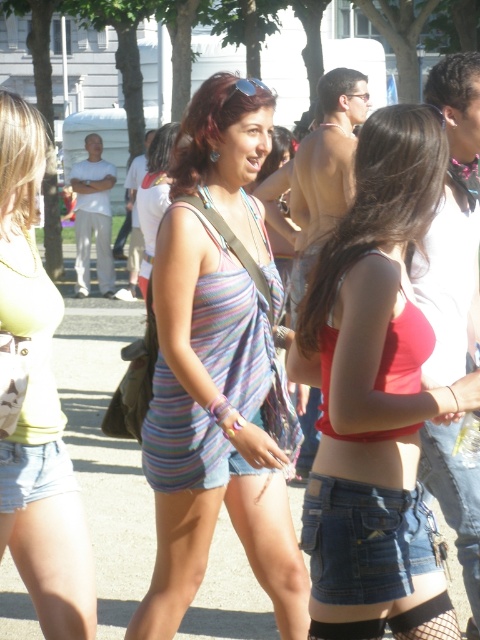
Question: Based on their relative distances, which object is nearer to the denim at lower center?

Choices:
 (A) matte yellow tank top at center
 (B) striped fabric dress at center
 (C) matte red tank top at center

Answer: (C)

Question: Does matte red tank top at center have a smaller size compared to matte yellow tank top at center?

Choices:
 (A) no
 (B) yes

Answer: (A)

Question: Among these objects, which one is nearest to the camera?

Choices:
 (A) denim at lower center
 (B) striped fabric dress at center
 (C) matte red tank top at center
 (D) matte yellow tank top at center

Answer: (C)

Question: Can you confirm if matte red tank top at center is thinner than denim at lower center?

Choices:
 (A) no
 (B) yes

Answer: (A)

Question: Is striped fabric dress at center smaller than matte yellow tank top at center?

Choices:
 (A) yes
 (B) no

Answer: (B)

Question: Which point is farther to the camera?

Choices:
 (A) striped fabric dress at center
 (B) matte yellow tank top at center
 (C) matte red tank top at center
 (D) denim at lower center

Answer: (A)